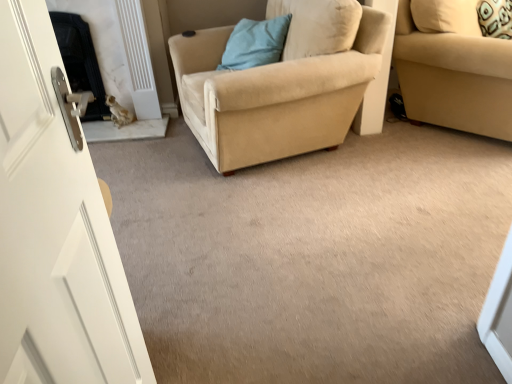
Question: From the image's perspective, would you say beige fabric studio couch at right is positioned over blue fabric pillow at upper center?

Choices:
 (A) no
 (B) yes

Answer: (A)

Question: Can you confirm if beige fabric studio couch at right is taller than blue fabric pillow at upper center?

Choices:
 (A) no
 (B) yes

Answer: (B)

Question: Would you say beige fabric studio couch at right contains blue fabric pillow at upper center?

Choices:
 (A) no
 (B) yes

Answer: (A)

Question: Does beige fabric studio couch at right have a lesser width compared to blue fabric pillow at upper center?

Choices:
 (A) yes
 (B) no

Answer: (B)

Question: Could you tell me if beige fabric studio couch at right is facing blue fabric pillow at upper center?

Choices:
 (A) yes
 (B) no

Answer: (B)

Question: Considering the relative sizes of beige fabric studio couch at right and blue fabric pillow at upper center in the image provided, is beige fabric studio couch at right bigger than blue fabric pillow at upper center?

Choices:
 (A) no
 (B) yes

Answer: (B)

Question: From the image's perspective, does beige suede armchair at center appear higher than blue fabric pillow at upper center?

Choices:
 (A) yes
 (B) no

Answer: (B)

Question: Can you confirm if beige suede armchair at center is positioned to the left of blue fabric pillow at upper center?

Choices:
 (A) yes
 (B) no

Answer: (B)

Question: Can you confirm if beige suede armchair at center is wider than blue fabric pillow at upper center?

Choices:
 (A) no
 (B) yes

Answer: (B)

Question: Is beige suede armchair at center to the right of blue fabric pillow at upper center from the viewer's perspective?

Choices:
 (A) yes
 (B) no

Answer: (A)

Question: From a real-world perspective, is beige suede armchair at center located beneath blue fabric pillow at upper center?

Choices:
 (A) no
 (B) yes

Answer: (B)

Question: Does beige suede armchair at center turn towards blue fabric pillow at upper center?

Choices:
 (A) no
 (B) yes

Answer: (B)

Question: Considering the relative sizes of beige suede armchair at center and beige fabric studio couch at right in the image provided, is beige suede armchair at center smaller than beige fabric studio couch at right?

Choices:
 (A) no
 (B) yes

Answer: (A)